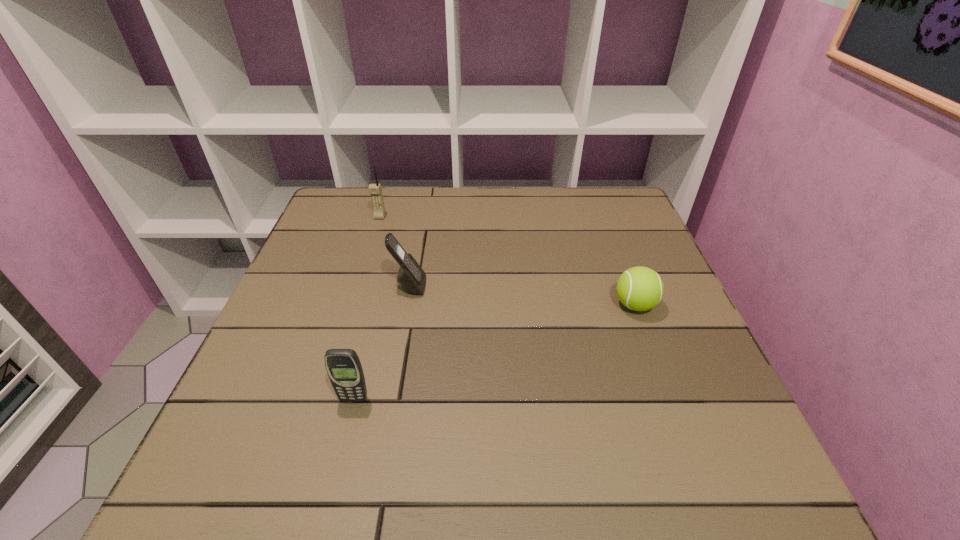
Locate an element on the screen. This screenshot has width=960, height=540. object situated at the far edge is located at coordinates (375, 190).

Identify the location of object situated at the left edge. The image size is (960, 540). (375, 190).

This screenshot has height=540, width=960. I want to click on object that is at the right edge, so click(x=639, y=288).

The image size is (960, 540). Find the location of `object present at the far left corner`. object present at the far left corner is located at coordinates (375, 190).

Locate an element on the screen. blank area at the far edge is located at coordinates (399, 201).

Where is `vacant space at the near edge`? vacant space at the near edge is located at coordinates tap(659, 487).

In the image, there is a desktop. At what (x,y) coordinates should I click in order to perform the action: click on free region at the left edge. Please return your answer as a coordinate pair (x, y). This screenshot has width=960, height=540. Looking at the image, I should click on (345, 278).

In the image, there is a desktop. At what (x,y) coordinates should I click in order to perform the action: click on free space at the right edge. Please return your answer as a coordinate pair (x, y). Looking at the image, I should click on (619, 247).

You are a GUI agent. You are given a task and a screenshot of the screen. Output one action in this format:
    pyautogui.click(x=<x>, y=<y>)
    Task: Click on the free region at the far left corner of the desktop
    
    Given the screenshot: What is the action you would take?
    pyautogui.click(x=372, y=226)

Where is `free space at the far right corner of the desktop`? Image resolution: width=960 pixels, height=540 pixels. free space at the far right corner of the desktop is located at coordinates [590, 213].